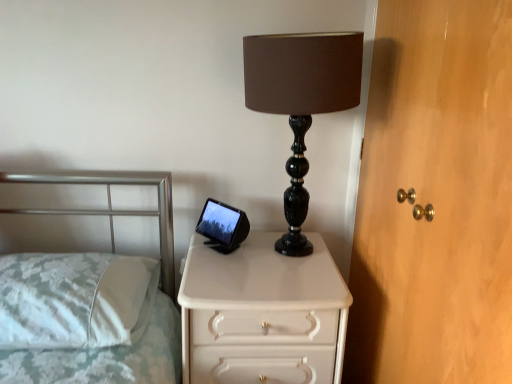
Question: Are white fabric pillow at left and black marble lamp at center located far from each other?

Choices:
 (A) yes
 (B) no

Answer: (B)

Question: Is white fabric pillow at left next to black marble lamp at center and touching it?

Choices:
 (A) yes
 (B) no

Answer: (B)

Question: Considering the relative sizes of white fabric pillow at left and black marble lamp at center in the image provided, is white fabric pillow at left bigger than black marble lamp at center?

Choices:
 (A) no
 (B) yes

Answer: (A)

Question: Can we say white fabric pillow at left lies outside black marble lamp at center?

Choices:
 (A) yes
 (B) no

Answer: (A)

Question: Is white fabric pillow at left oriented towards black marble lamp at center?

Choices:
 (A) yes
 (B) no

Answer: (B)

Question: Does white fabric pillow at left appear on the left side of black marble lamp at center?

Choices:
 (A) yes
 (B) no

Answer: (A)

Question: From the image's perspective, is wooden dresser at right under black marble lamp at center?

Choices:
 (A) yes
 (B) no

Answer: (A)

Question: Is wooden dresser at right positioned beyond the bounds of black marble lamp at center?

Choices:
 (A) no
 (B) yes

Answer: (B)

Question: From a real-world perspective, is wooden dresser at right positioned under black marble lamp at center based on gravity?

Choices:
 (A) yes
 (B) no

Answer: (A)

Question: Considering the relative positions of wooden dresser at right and black marble lamp at center in the image provided, is wooden dresser at right to the left of black marble lamp at center from the viewer's perspective?

Choices:
 (A) no
 (B) yes

Answer: (A)

Question: Can you confirm if wooden dresser at right is smaller than black marble lamp at center?

Choices:
 (A) yes
 (B) no

Answer: (B)

Question: Does wooden dresser at right have a greater width compared to black marble lamp at center?

Choices:
 (A) yes
 (B) no

Answer: (B)

Question: Can you confirm if white fabric pillow at left is wider than wooden dresser at right?

Choices:
 (A) no
 (B) yes

Answer: (B)